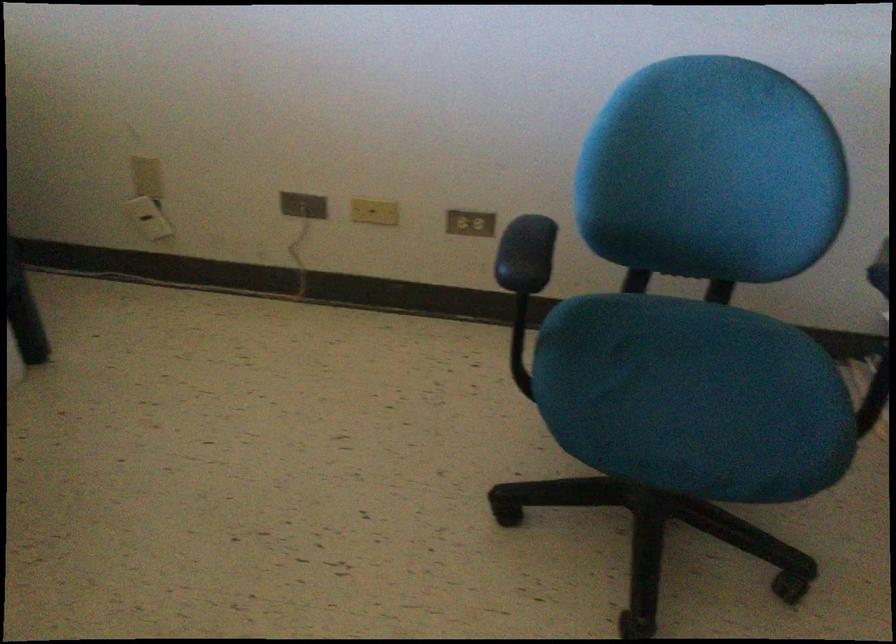
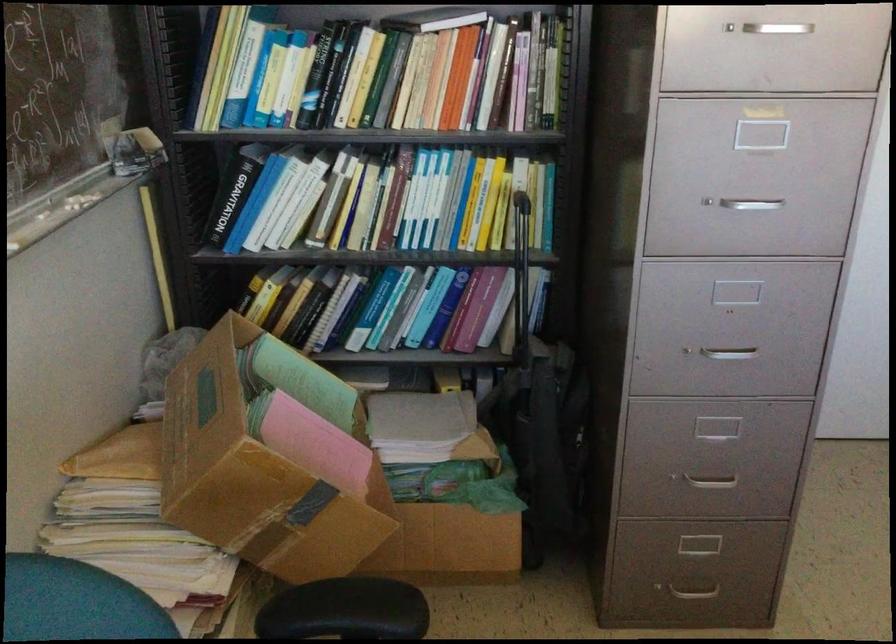
The images are taken continuously from a first-person perspective. In which direction is your viewpoint rotating?

The camera rotated toward right-down.